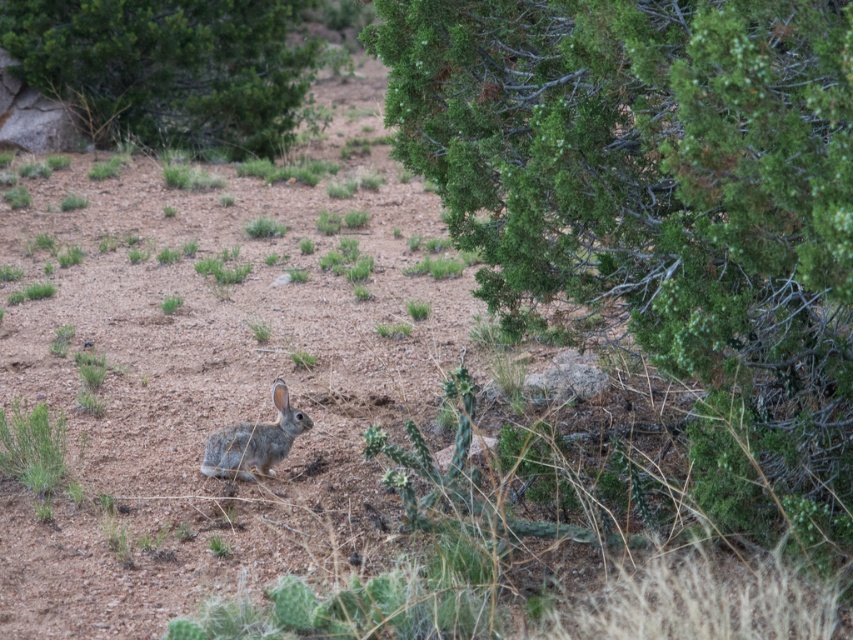
Question: Can you confirm if green textured tree at center right is positioned below fuzzy gray rabbit at center?

Choices:
 (A) no
 (B) yes

Answer: (A)

Question: Which point is farther to the camera?

Choices:
 (A) (253, 464)
 (B) (256, 124)

Answer: (B)

Question: Which point appears farthest from the camera in this image?

Choices:
 (A) (582, 211)
 (B) (218, 451)

Answer: (B)

Question: Which of the following is the closest to the observer?

Choices:
 (A) fuzzy gray rabbit at center
 (B) green leafy tree at upper left
 (C) green textured tree at center right

Answer: (C)

Question: Is green leafy tree at upper left to the right of fuzzy gray rabbit at center from the viewer's perspective?

Choices:
 (A) yes
 (B) no

Answer: (B)

Question: Is green textured tree at center right behind green leafy tree at upper left?

Choices:
 (A) no
 (B) yes

Answer: (A)